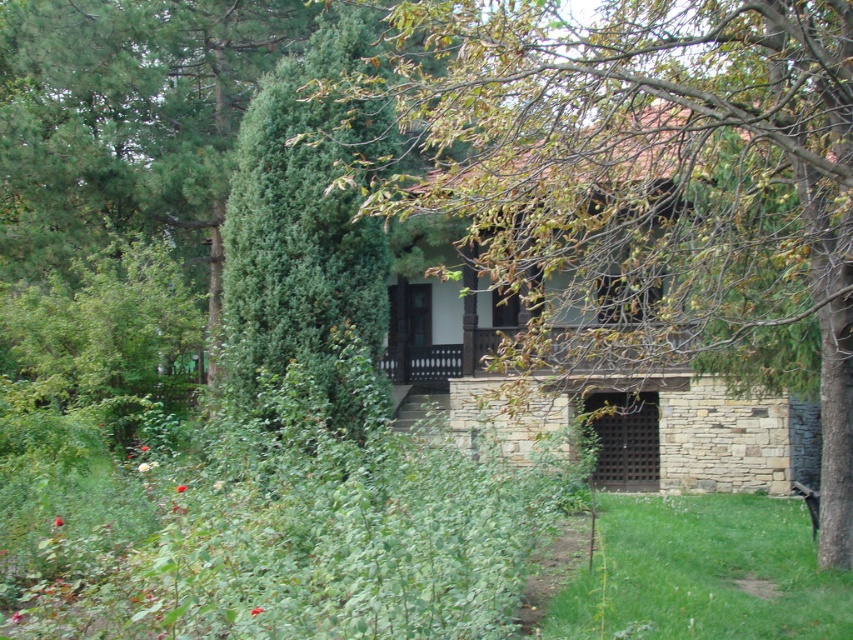
How much distance is there between green leafy tree at center and green textured bush at center?

14.77 feet

Is point (709, 163) less distant than point (270, 163)?

That is True.

Where is `green leafy tree at center`? green leafy tree at center is located at coordinates (643, 182).

Locate an element on the screen. The image size is (853, 640). green leafy tree at center is located at coordinates (643, 182).